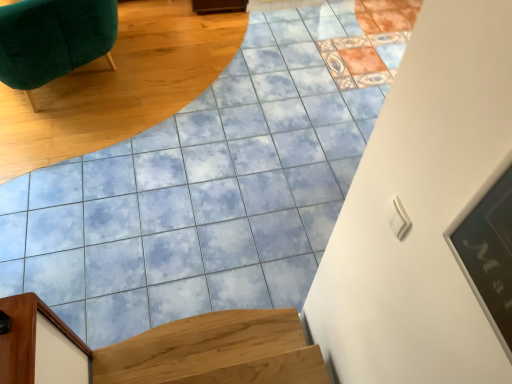
Question: From a real-world perspective, is velvet green chair at upper left, positioned as the second furniture in front-to-back order, positioned above or below light brown wood stairs at lower left?

Choices:
 (A) below
 (B) above

Answer: (B)

Question: Considering their positions, is velvet green chair at upper left, the 2th furniture positioned from the right, located in front of or behind light brown wood stairs at lower left?

Choices:
 (A) behind
 (B) front

Answer: (A)

Question: Which object is the farthest from the light brown wood stairs at lower left?

Choices:
 (A) velvet green chair at upper left, which is counted as the 1th furniture, starting from the back
 (B) wooden door frame at lower left, the first furniture in the bottom-to-top sequence

Answer: (A)

Question: Which object is the farthest from the velvet green chair at upper left, the 2th furniture positioned from the right?

Choices:
 (A) light brown wood stairs at lower left
 (B) wooden door frame at lower left, which is the first furniture in right-to-left order

Answer: (A)